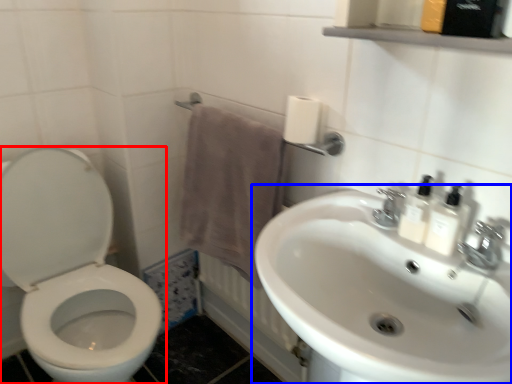
Question: Which point is further to the camera, toilet (highlighted by a red box) or sink (highlighted by a blue box)?

Choices:
 (A) toilet
 (B) sink

Answer: (A)